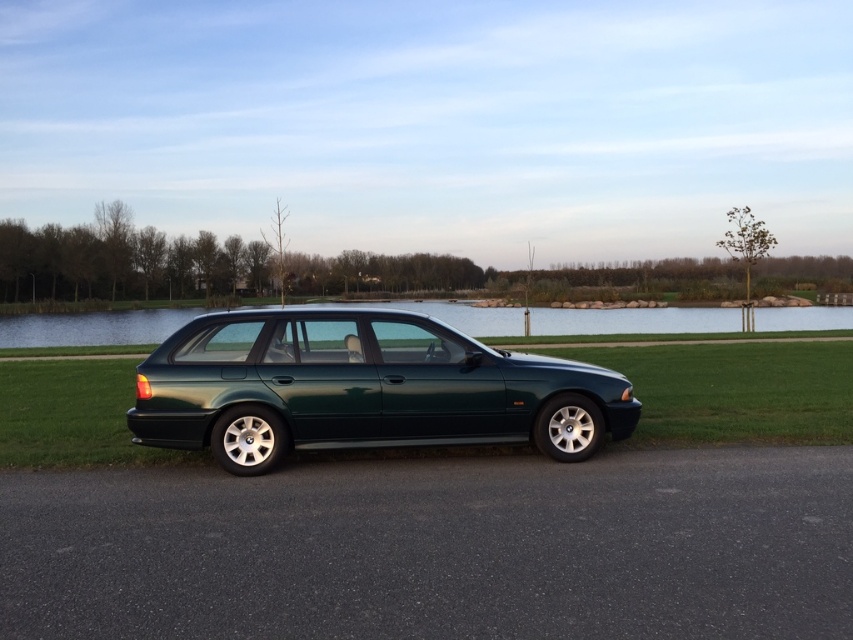
Question: Can you confirm if metallic green wagon at center is smaller than transparent glass water at center?

Choices:
 (A) yes
 (B) no

Answer: (A)

Question: Among these objects, which one is farthest from the camera?

Choices:
 (A) transparent glass water at center
 (B) metallic green wagon at center

Answer: (A)

Question: Does metallic green wagon at center have a larger size compared to transparent glass water at center?

Choices:
 (A) no
 (B) yes

Answer: (A)

Question: Which point is farther to the camera?

Choices:
 (A) (209, 413)
 (B) (676, 326)

Answer: (B)

Question: Which of the following is the farthest from the observer?

Choices:
 (A) transparent glass water at center
 (B) metallic green wagon at center

Answer: (A)

Question: Can you confirm if metallic green wagon at center is smaller than transparent glass water at center?

Choices:
 (A) no
 (B) yes

Answer: (B)